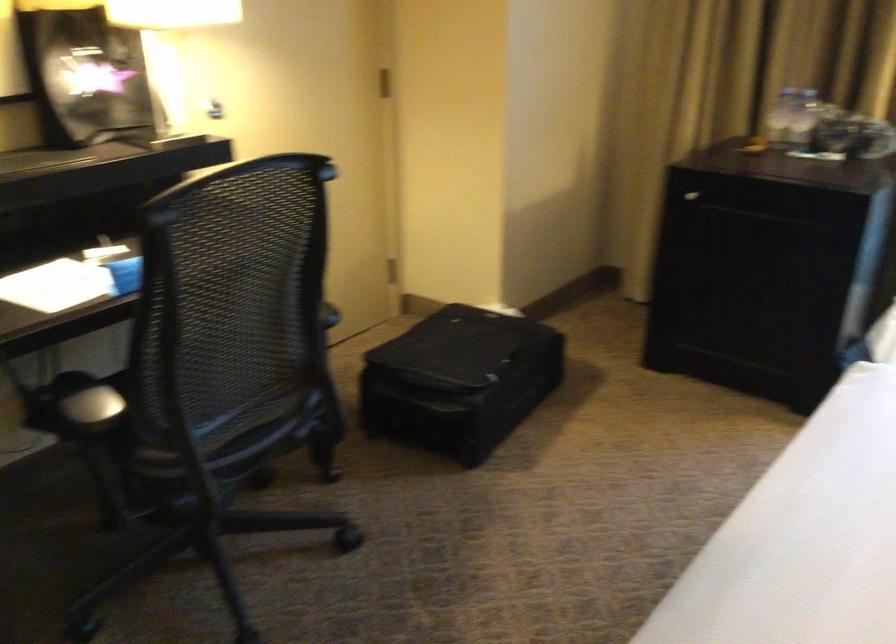
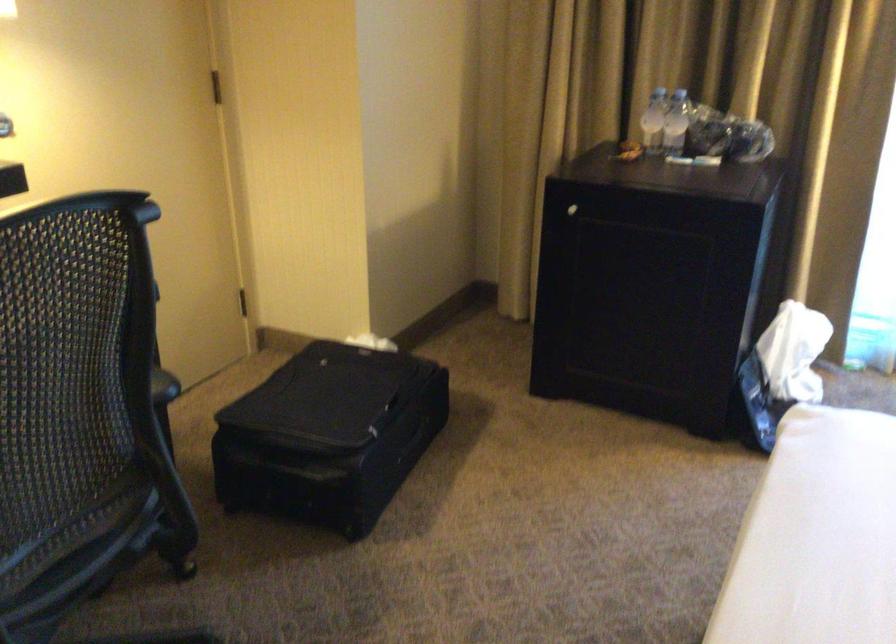
The point at (690,196) is marked in the first image. Where is the corresponding point in the second image?

(572, 210)